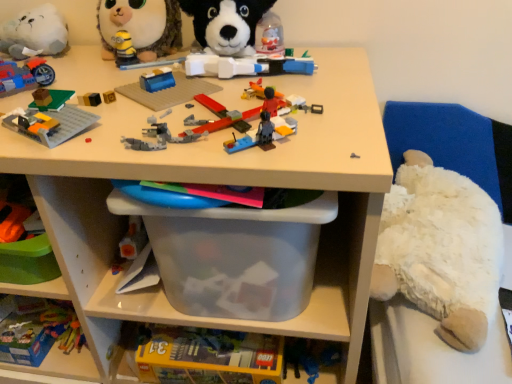
Question: Considering the relative sizes of matte blue motorcycle at upper left, the 3th toy positioned from the left, and fluffy plush toy at upper left, the fourth toy in the right-to-left sequence, in the image provided, is matte blue motorcycle at upper left, the 3th toy positioned from the left, bigger than fluffy plush toy at upper left, the fourth toy in the right-to-left sequence,?

Choices:
 (A) no
 (B) yes

Answer: (A)

Question: Is matte blue motorcycle at upper left, the 3th toy positioned from the left, at the right side of fluffy plush toy at upper left, the fourth toy in the right-to-left sequence?

Choices:
 (A) no
 (B) yes

Answer: (A)

Question: Could you tell me if matte blue motorcycle at upper left, arranged as the sixth toy when viewed from the right, is turned towards fluffy plush toy at upper left, the fifth toy positioned from the left?

Choices:
 (A) no
 (B) yes

Answer: (A)

Question: From the image's perspective, does matte blue motorcycle at upper left, arranged as the sixth toy when viewed from the right, appear lower than fluffy plush toy at upper left, the fourth toy in the right-to-left sequence?

Choices:
 (A) yes
 (B) no

Answer: (A)

Question: From the image's perspective, is matte blue motorcycle at upper left, arranged as the sixth toy when viewed from the right, over fluffy plush toy at upper left, the fifth toy positioned from the left?

Choices:
 (A) no
 (B) yes

Answer: (A)

Question: Is matte blue motorcycle at upper left, arranged as the sixth toy when viewed from the right, behind fluffy plush toy at upper left, the fourth toy in the right-to-left sequence?

Choices:
 (A) no
 (B) yes

Answer: (A)

Question: Is matte blue motorcycle at upper left, the 3th toy positioned from the left, oriented away from white plush at right?

Choices:
 (A) yes
 (B) no

Answer: (B)

Question: Could you tell me if matte blue motorcycle at upper left, arranged as the sixth toy when viewed from the right, is turned towards white plush at right?

Choices:
 (A) no
 (B) yes

Answer: (A)

Question: Does matte blue motorcycle at upper left, arranged as the sixth toy when viewed from the right, come behind white plush at right?

Choices:
 (A) yes
 (B) no

Answer: (B)

Question: Are matte blue motorcycle at upper left, arranged as the sixth toy when viewed from the right, and white plush at right beside each other?

Choices:
 (A) no
 (B) yes

Answer: (A)

Question: From the image's perspective, is matte blue motorcycle at upper left, arranged as the sixth toy when viewed from the right, above white plush at right?

Choices:
 (A) yes
 (B) no

Answer: (A)

Question: Is white plush at right completely or partially inside matte blue motorcycle at upper left, the 3th toy positioned from the left?

Choices:
 (A) yes
 (B) no

Answer: (B)

Question: Is there a large distance between translucent plastic baseplate at upper left, the fifth toy from the right, and white plush cat at upper left, the seventh toy viewed from the right?

Choices:
 (A) yes
 (B) no

Answer: (B)